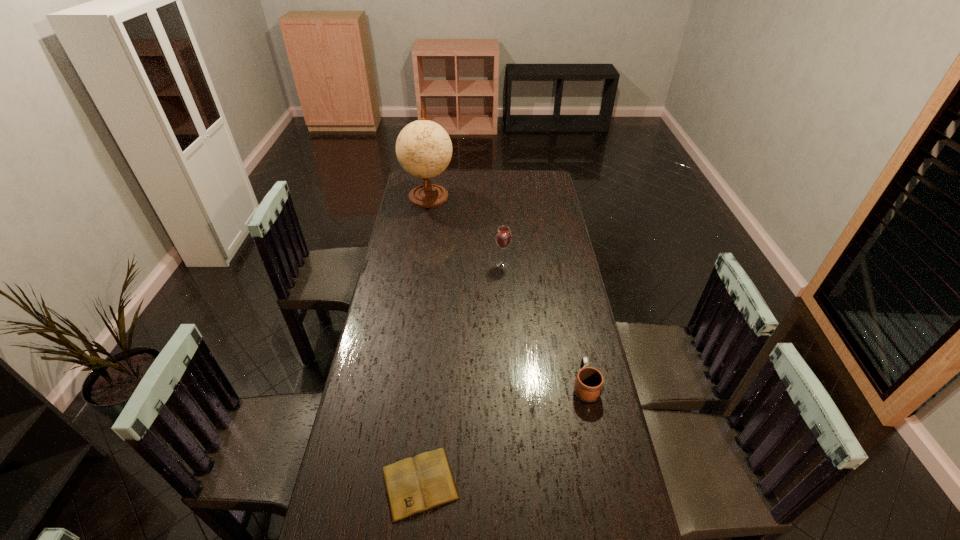
You are a GUI agent. You are given a task and a screenshot of the screen. Output one action in this format:
    pyautogui.click(x=<x>, y=<y>)
    Task: Click on the tallest object
    This screenshot has width=960, height=540.
    Given the screenshot: What is the action you would take?
    pyautogui.click(x=423, y=148)

Find the location of `the farthest object`. the farthest object is located at coordinates point(423,148).

Locate an element on the screen. The height and width of the screenshot is (540, 960). the second object from right to left is located at coordinates (503, 237).

This screenshot has width=960, height=540. What are the coordinates of `the third shortest object` in the screenshot? It's located at (503, 237).

At what (x,y) coordinates should I click in order to perform the action: click on the third farthest object. Please return your answer as a coordinate pair (x, y). Looking at the image, I should click on click(589, 382).

Identify the location of the rightmost object. The image size is (960, 540). (589, 382).

This screenshot has height=540, width=960. Find the location of `the nearest object`. the nearest object is located at coordinates (413, 485).

Where is `book`? book is located at coordinates (413, 485).

I want to click on free space located 0.220m on the surface of the globe, so point(421,240).

This screenshot has height=540, width=960. Find the location of `vacant space situated on the left of the wineglass`. vacant space situated on the left of the wineglass is located at coordinates (414, 264).